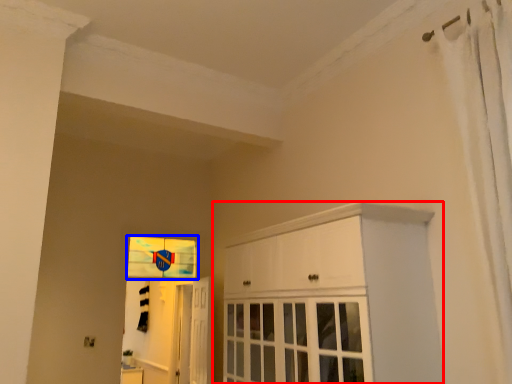
Question: Among these objects, which one is nearest to the camera, cabinetry (highlighted by a red box) or window (highlighted by a blue box)?

Choices:
 (A) cabinetry
 (B) window

Answer: (A)